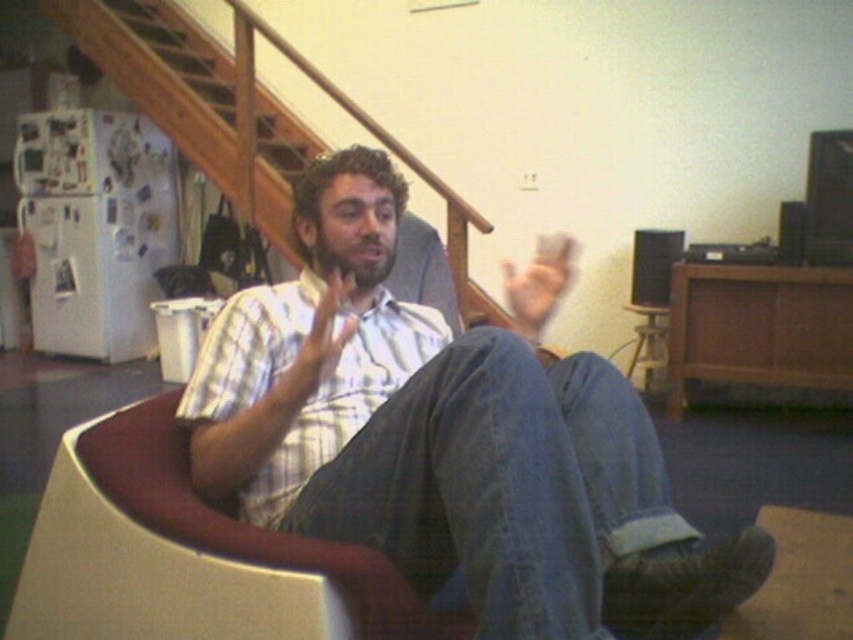
You are organizing a small gathering and need to place a decorative pillow between the plaid shirt at center and the white plastic swivel chair at center. Based on their positions, where should you place the pillow?

The plaid shirt at center is positioned on the right side of the white plastic swivel chair at center, so the decorative pillow should be placed between them, to the right of the white plastic swivel chair at center and to the left of the plaid shirt at center.

Looking at this image, based on the scene description, where is the plaid shirt at center located in terms of coordinates?

The plaid shirt at center is located at coordinates point (x=450, y=436).